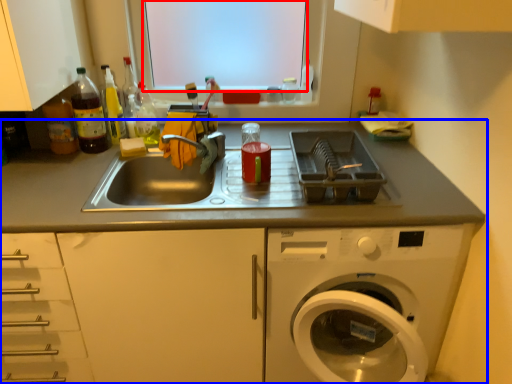
Question: Which object is closer to the camera taking this photo, window screen (highlighted by a red box) or countertop (highlighted by a blue box)?

Choices:
 (A) window screen
 (B) countertop

Answer: (B)